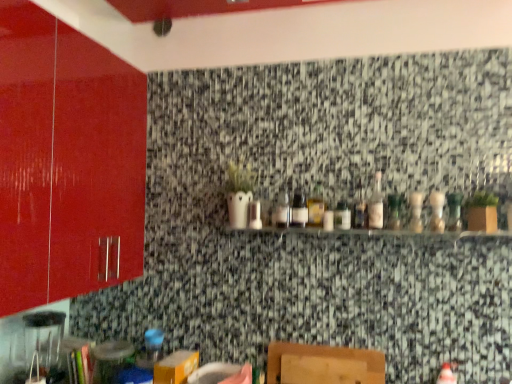
Find the location of a particular element. empty space that is ontop of clear glass shelf at center is located at coordinates (375, 226).